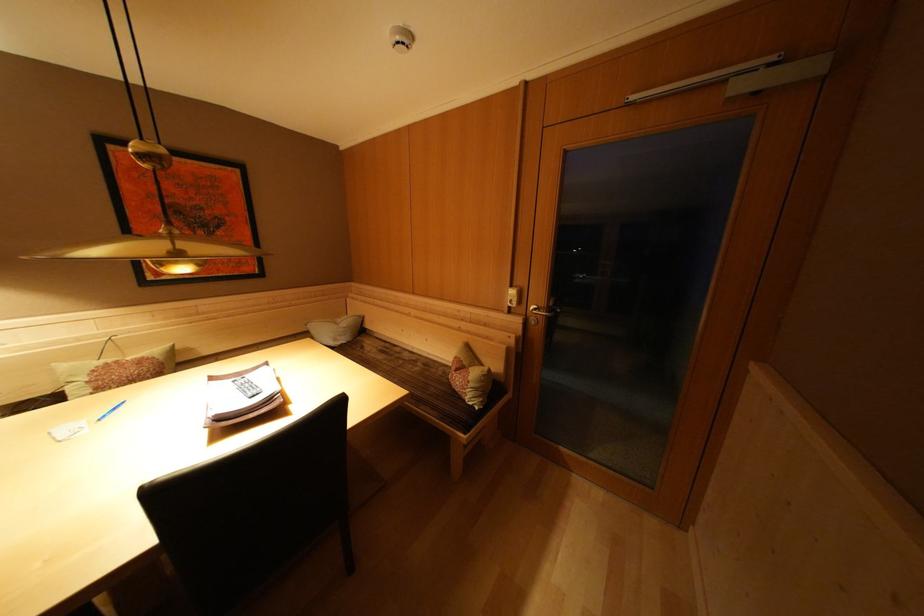
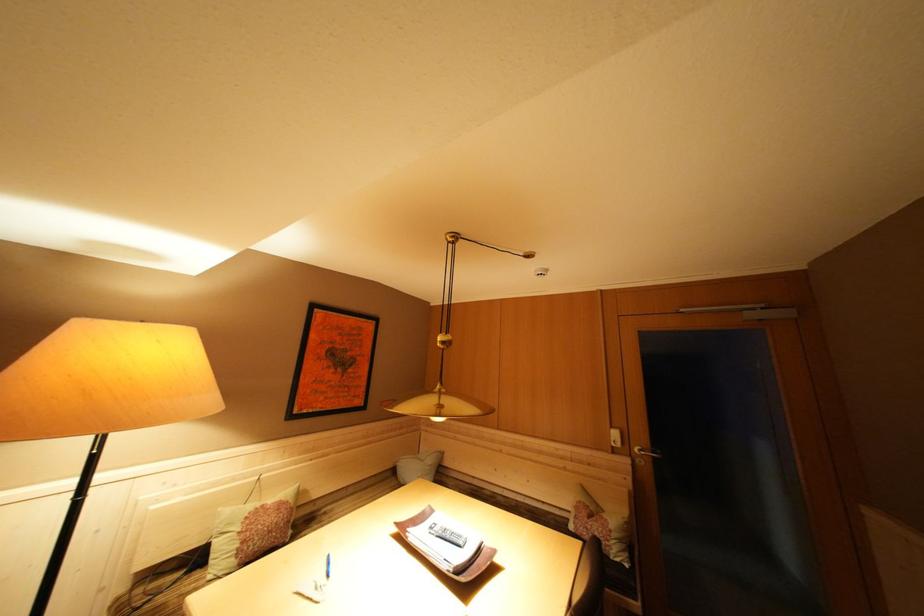
Which direction would the cameraman need to move to produce the second image?

The cameraman moved toward left, backward.